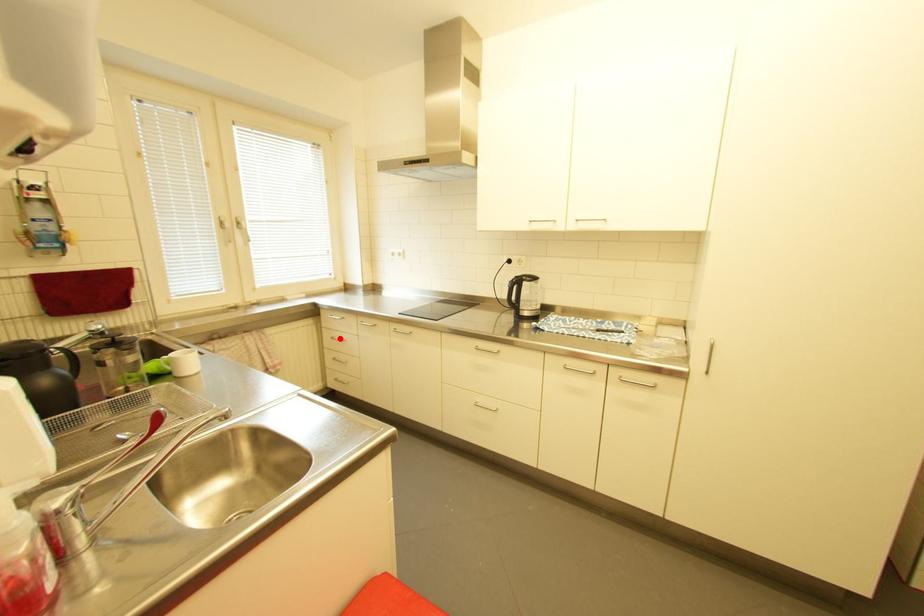
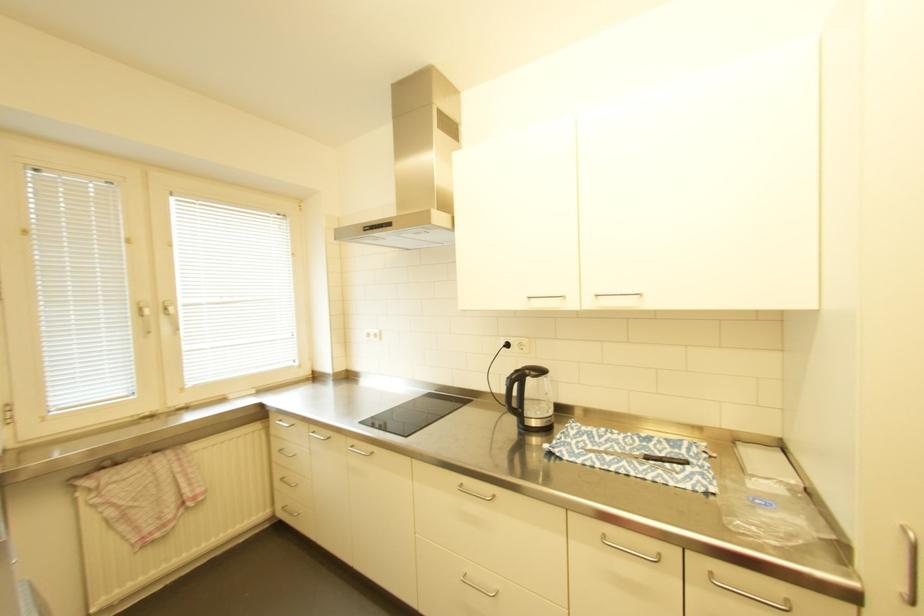
Find the pixel in the second image that matches the highlighted location in the first image.

(287, 451)